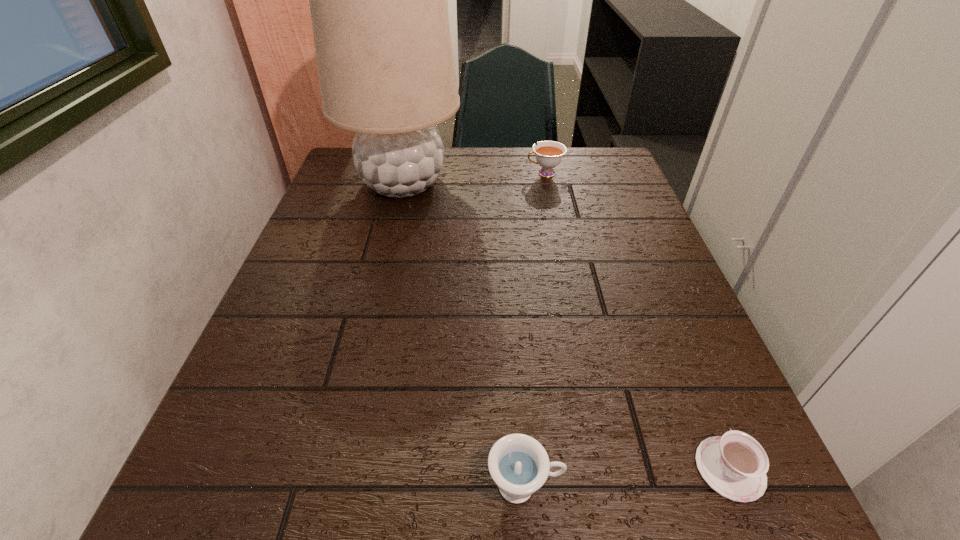
The image size is (960, 540). I want to click on object located in the near right corner section of the desktop, so click(x=735, y=465).

Locate an element on the screen. free space at the far edge of the desktop is located at coordinates (478, 183).

At what (x,y) coordinates should I click in order to perform the action: click on free space at the near edge of the desktop. Please return your answer as a coordinate pair (x, y). Image resolution: width=960 pixels, height=540 pixels. Looking at the image, I should click on (372, 518).

You are a GUI agent. You are given a task and a screenshot of the screen. Output one action in this format:
    pyautogui.click(x=<x>, y=<y>)
    Task: Click on the free space at the left edge of the desktop
    
    Given the screenshot: What is the action you would take?
    pyautogui.click(x=353, y=295)

In the image, there is a desktop. Identify the location of vacant space at the right edge. This screenshot has width=960, height=540. (643, 341).

What are the coordinates of `vacant space at the far left corner` in the screenshot? It's located at click(345, 173).

This screenshot has width=960, height=540. I want to click on vacant space at the far right corner of the desktop, so click(x=596, y=152).

In the image, there is a desktop. Identify the location of free space at the near right corner. The image size is (960, 540). (768, 488).

Where is `vacant area between the lampshade and the shortest teacup`? This screenshot has width=960, height=540. vacant area between the lampshade and the shortest teacup is located at coordinates (566, 326).

You are a GUI agent. You are given a task and a screenshot of the screen. Output one action in this format:
    pyautogui.click(x=<x>, y=<y>)
    Task: Click on the vacant area that lies between the third object from left to right and the leftmost teacup
    Image resolution: width=960 pixels, height=540 pixels.
    Given the screenshot: What is the action you would take?
    pyautogui.click(x=535, y=329)